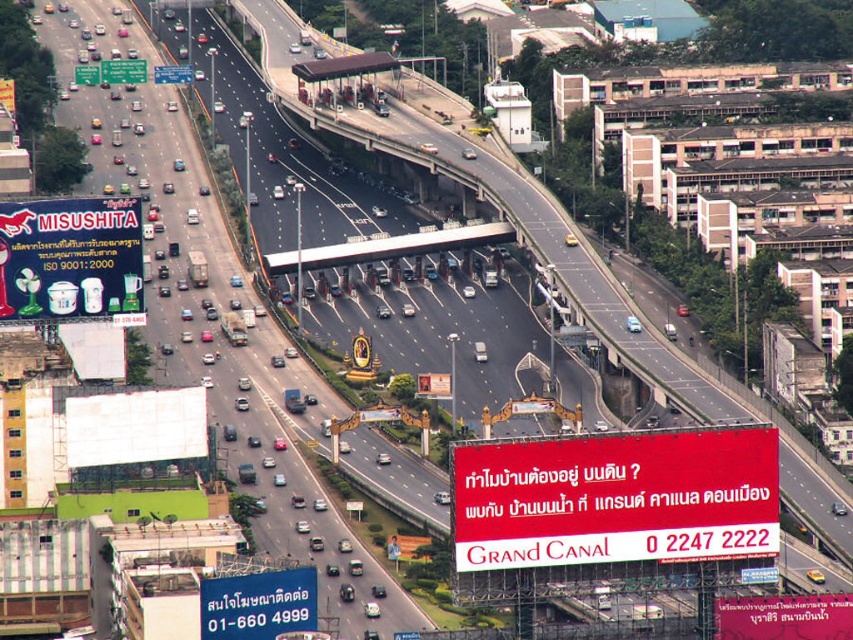
Based on the photo, you are a drone operator flying over the highway. You need to deliver a package to a point that is closer to the camera. Which point should you choose between point (763, 436) and point (181, 72)?

Point (763, 436) is closer to the camera than point (181, 72), so you should choose point (763, 436) to deliver the package.

You are a driver approaching the toll booth and see the red matte sign at center and the blue plastic sign at lower left. Which sign is positioned more to the right side from your perspective?

The red matte sign at center is positioned to the right of the blue plastic sign at lower left, so the red matte sign at center is more to the right side.

You are a delivery driver who needs to place a white plastic blender at upper left and a blue plastic sign at lower left in your truck. Given that the truck has limited space, which item should you prioritize placing first to ensure both fit?

The white plastic blender at upper left is larger than the blue plastic sign at lower left, so you should place the white plastic blender at upper left first to ensure both items fit in the truck.